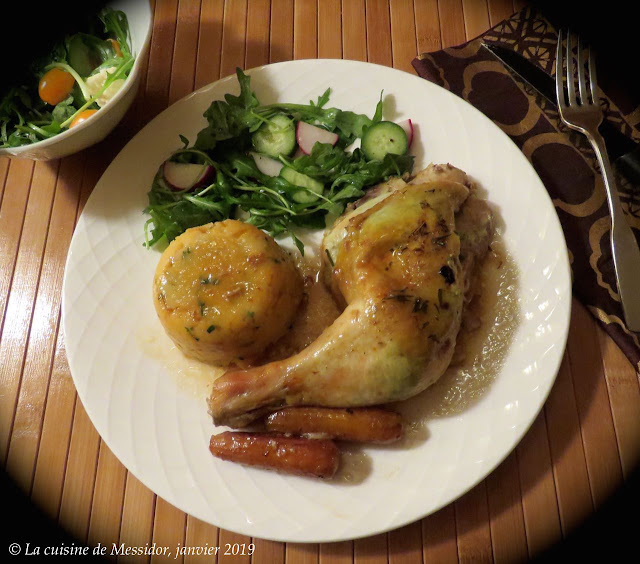
Where is `plate`? plate is located at coordinates tap(427, 113).